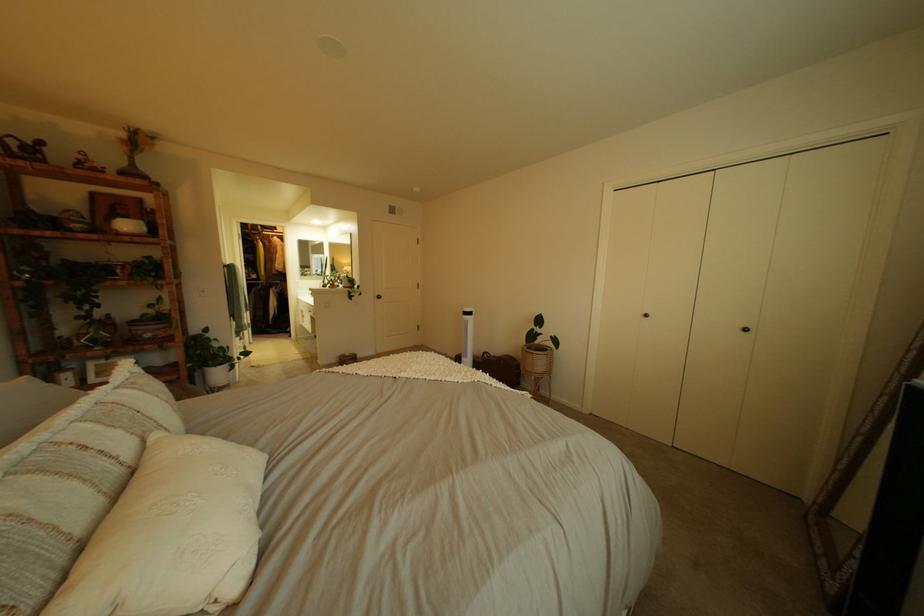
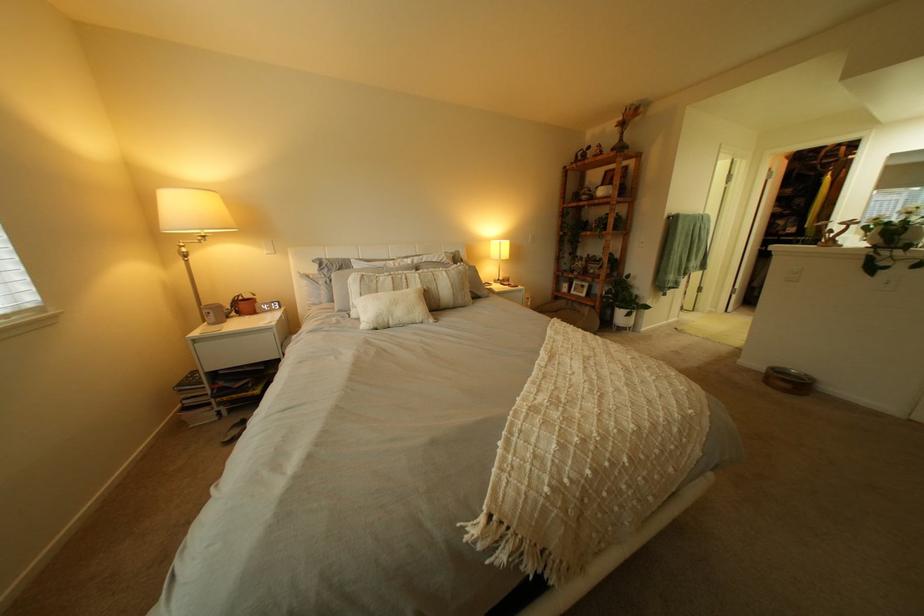
Where in the second image is the point corresponding to (134,434) from the first image?

(434, 283)